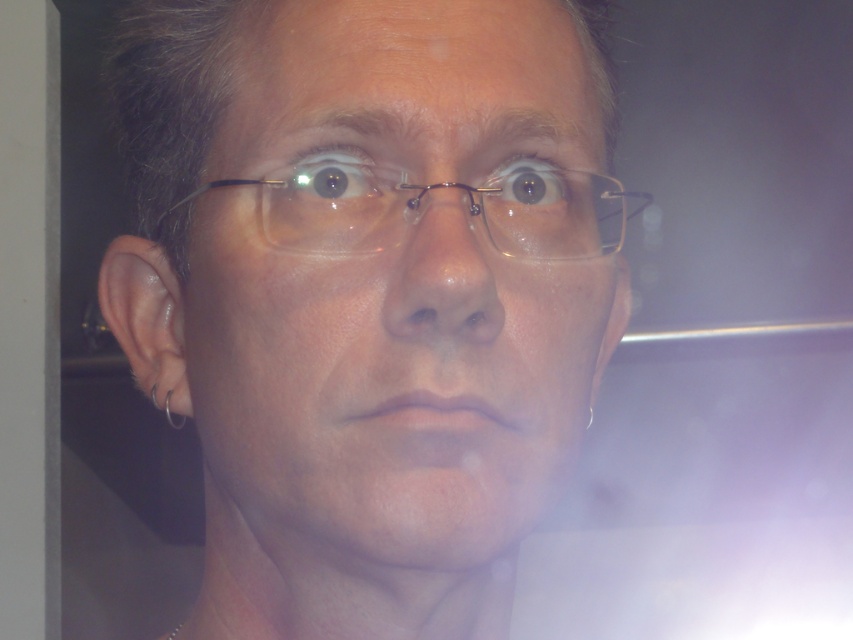
Question: Based on their relative distances, which object is nearer to the brown glossy eye at center?

Choices:
 (A) silver metallic earring at left
 (B) silver metallic hoop earring at left
 (C) metallic wireframe glasses at center

Answer: (C)

Question: Is matte glass eye at upper center behind brown glossy eye at center?

Choices:
 (A) yes
 (B) no

Answer: (B)

Question: Is metallic wireframe glasses at center positioned in front of brown glossy eye at center?

Choices:
 (A) no
 (B) yes

Answer: (B)

Question: Which point is farther from the camera taking this photo?

Choices:
 (A) pyautogui.click(x=167, y=410)
 (B) pyautogui.click(x=560, y=182)

Answer: (A)

Question: Considering the real-world distances, which object is farthest from the metallic wireframe glasses at center?

Choices:
 (A) silver metallic earring at left
 (B) brown glossy eye at center
 (C) silver metallic hoop earring at left

Answer: (C)

Question: Does matte glass eye at upper center have a lesser width compared to brown glossy eye at center?

Choices:
 (A) yes
 (B) no

Answer: (A)